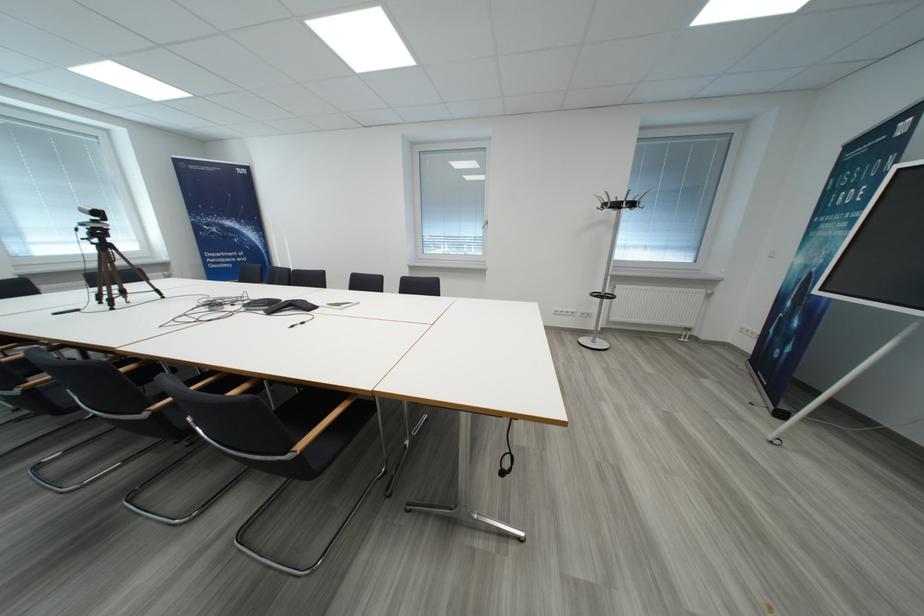
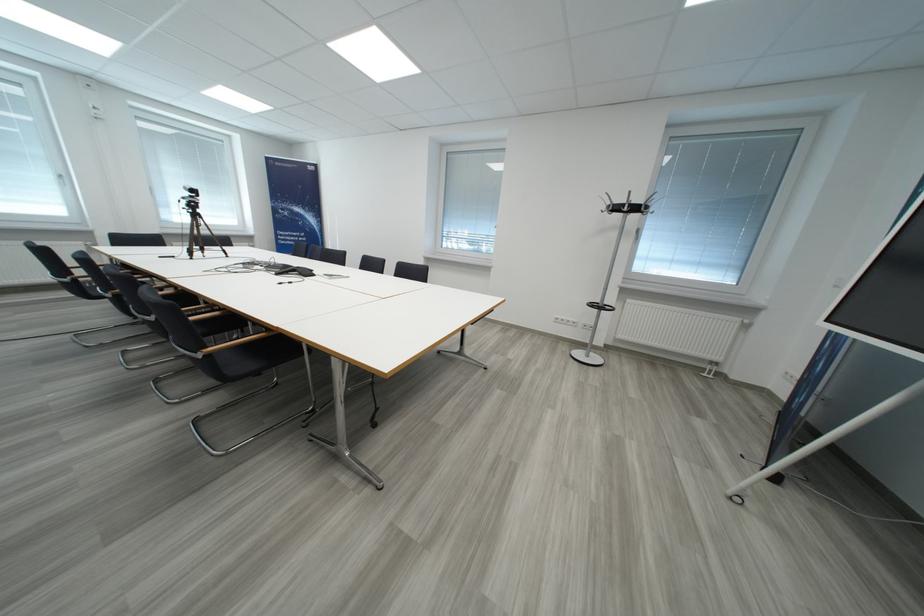
Question: The first image is from the beginning of the video and the second image is from the end. How did the camera likely rotate when shooting the video?

Choices:
 (A) Left
 (B) Right
 (C) Up
 (D) Down

Answer: (A)